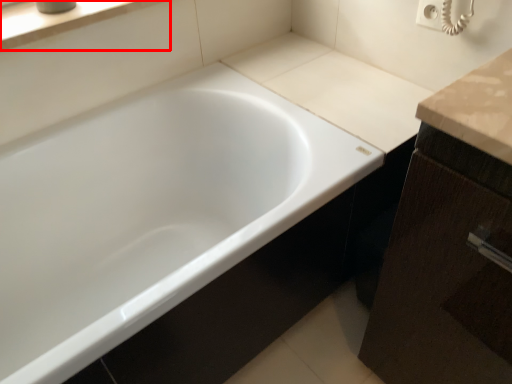
Question: From the image's perspective, where is window sill (annotated by the red box) located relative to bathtub?

Choices:
 (A) below
 (B) above

Answer: (B)